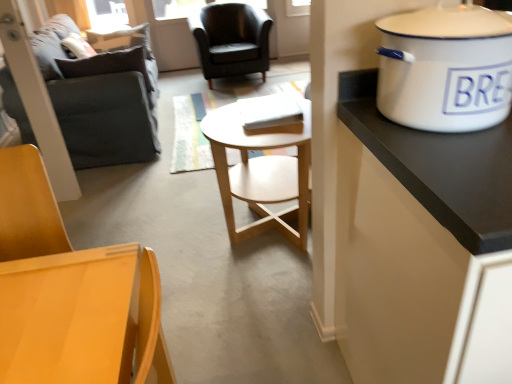
Question: Is the depth of white enamel cooker at upper right greater than that of matte wood chair at lower left, the second chair viewed from the back?

Choices:
 (A) yes
 (B) no

Answer: (A)

Question: Is white enamel cooker at upper right beside matte wood chair at lower left, placed as the second chair when sorted from top to bottom?

Choices:
 (A) no
 (B) yes

Answer: (A)

Question: Considering the relative sizes of white enamel cooker at upper right and matte wood chair at lower left, placed as the 1th chair when sorted from front to back, in the image provided, is white enamel cooker at upper right smaller than matte wood chair at lower left, placed as the 1th chair when sorted from front to back,?

Choices:
 (A) no
 (B) yes

Answer: (B)

Question: Is white enamel cooker at upper right turned away from matte wood chair at lower left, placed as the second chair when sorted from top to bottom?

Choices:
 (A) no
 (B) yes

Answer: (A)

Question: Is white enamel cooker at upper right not close to matte wood chair at lower left, placed as the second chair when sorted from top to bottom?

Choices:
 (A) no
 (B) yes

Answer: (A)

Question: Would you say white enamel cooker at upper right is to the left or to the right of light wood/woodenobject at center in the picture?

Choices:
 (A) right
 (B) left

Answer: (A)

Question: Is point (423, 97) closer or farther from the camera than point (279, 183)?

Choices:
 (A) farther
 (B) closer

Answer: (B)

Question: Looking at their shapes, would you say white enamel cooker at upper right is wider or thinner than light wood/woodenobject at center?

Choices:
 (A) thin
 (B) wide

Answer: (A)

Question: From the image's perspective, is white enamel cooker at upper right above or below light wood/woodenobject at center?

Choices:
 (A) above
 (B) below

Answer: (A)

Question: Relative to white enamel cooker at upper right, is dark gray fabric couch at left in front or behind?

Choices:
 (A) front
 (B) behind

Answer: (B)

Question: Based on their sizes in the image, would you say dark gray fabric couch at left is bigger or smaller than white enamel cooker at upper right?

Choices:
 (A) big
 (B) small

Answer: (A)

Question: From their relative heights in the image, would you say dark gray fabric couch at left is taller or shorter than white enamel cooker at upper right?

Choices:
 (A) tall
 (B) short

Answer: (A)

Question: Is point (131, 139) positioned closer to the camera than point (455, 72)?

Choices:
 (A) closer
 (B) farther

Answer: (B)

Question: From the image's perspective, relative to matte wood chair at lower left, the second chair viewed from the back, is matte black armchair at center, the 2th chair in the front-to-back sequence, above or below?

Choices:
 (A) below
 (B) above

Answer: (B)

Question: From a real-world perspective, relative to matte wood chair at lower left, positioned as the first chair in bottom-to-top order, is matte black armchair at center, the 1th chair viewed from the back, vertically above or below?

Choices:
 (A) below
 (B) above

Answer: (A)